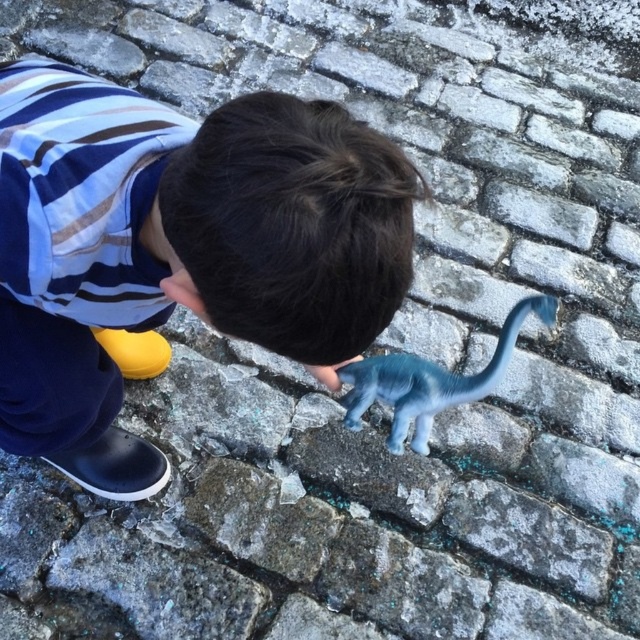
Is blue rubber boots at lower left closer to the viewer compared to blue rubber dinosaur at center?

Yes.

Does blue rubber boots at lower left appear on the right side of blue rubber dinosaur at center?

In fact, blue rubber boots at lower left is to the left of blue rubber dinosaur at center.

Which is in front, point (118, 189) or point (435, 400)?

Point (118, 189)

Where is `blue rubber boots at lower left`? This screenshot has width=640, height=640. blue rubber boots at lower left is located at coordinates (179, 250).